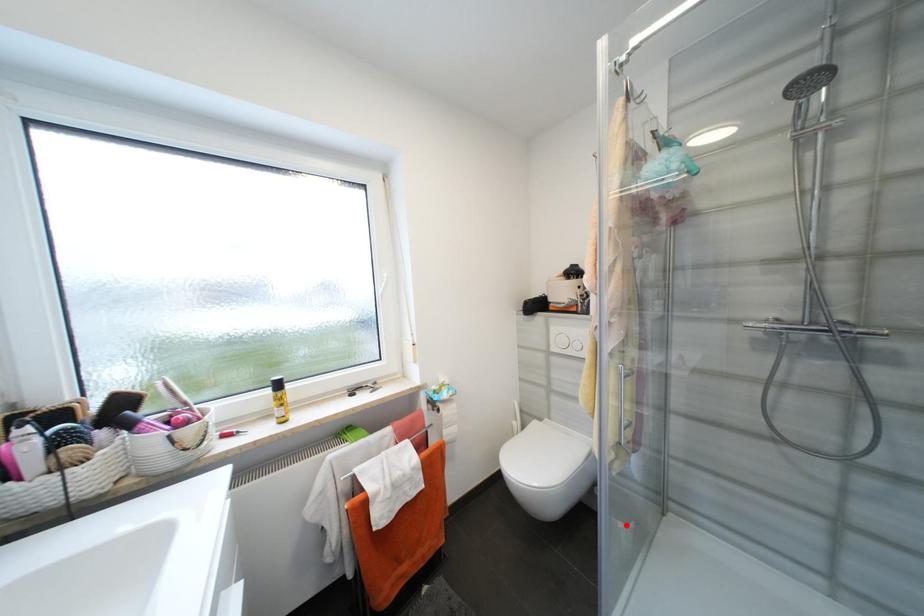
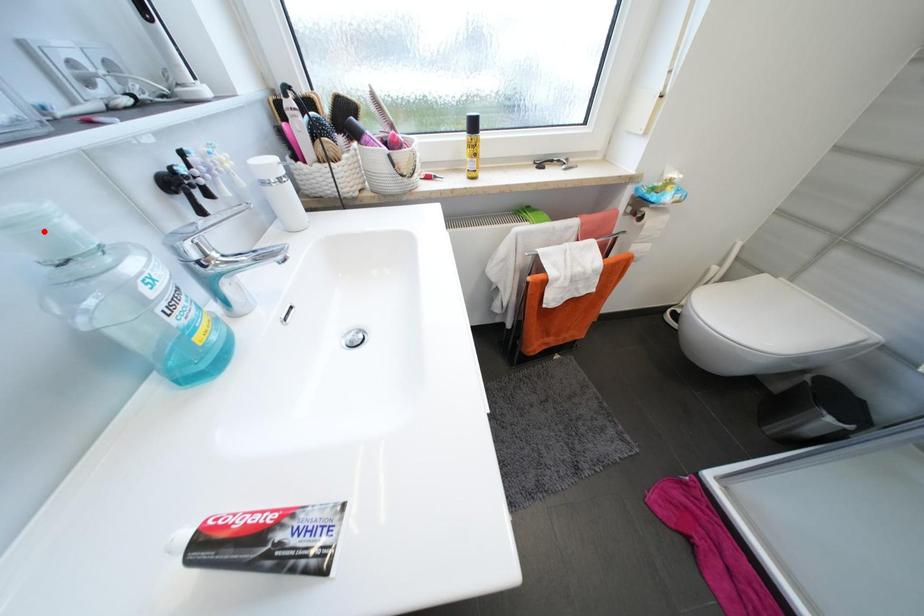
Based on the photo, I am providing you with two images of the same scene from different viewpoints. A red point is marked on the first image and another point is marked on the second image. Is the marked point in image1 the same physical position as the marked point in image2?

No